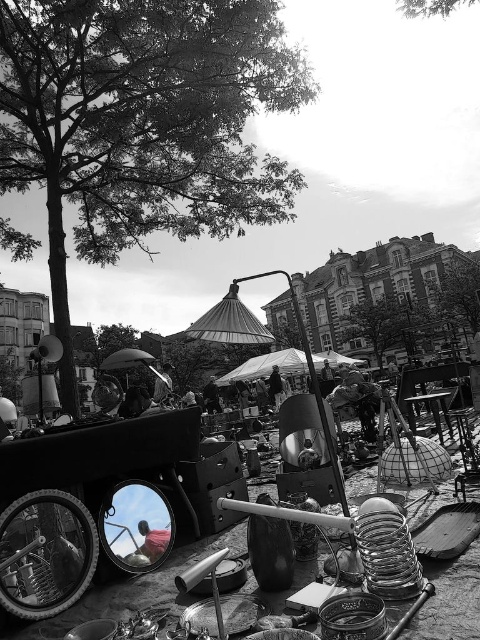
Does metallic reflective mirror at center have a lesser height compared to wooden picnic table at center?

Yes, metallic reflective mirror at center is shorter than wooden picnic table at center.

Does metallic reflective mirror at center appear on the left side of wooden picnic table at center?

Indeed, metallic reflective mirror at center is positioned on the left side of wooden picnic table at center.

Is point (355, 488) positioned after point (447, 429)?

That is False.

The height and width of the screenshot is (640, 480). What are the coordinates of `metallic reflective mirror at center` in the screenshot? It's located at (133, 589).

Between metallic reflective mirror at center and transparent fabric umbrella at center, which one appears on the right side from the viewer's perspective?

Positioned to the right is transparent fabric umbrella at center.

Measure the distance between metallic reflective mirror at center and camera.

The distance of metallic reflective mirror at center from camera is 3.28 meters.

The image size is (480, 640). In order to click on metallic reflective mirror at center in this screenshot , I will do `click(133, 589)`.

Looking at this image, measure the distance from transparent fabric umbrella at center to wooden picnic table at center.

transparent fabric umbrella at center is 40.23 feet from wooden picnic table at center.

Does transparent fabric umbrella at center appear over wooden picnic table at center?

No, transparent fabric umbrella at center is not above wooden picnic table at center.

This screenshot has height=640, width=480. Identify the location of transparent fabric umbrella at center. (267, 365).

Image resolution: width=480 pixels, height=640 pixels. Identify the location of transparent fabric umbrella at center. (267, 365).